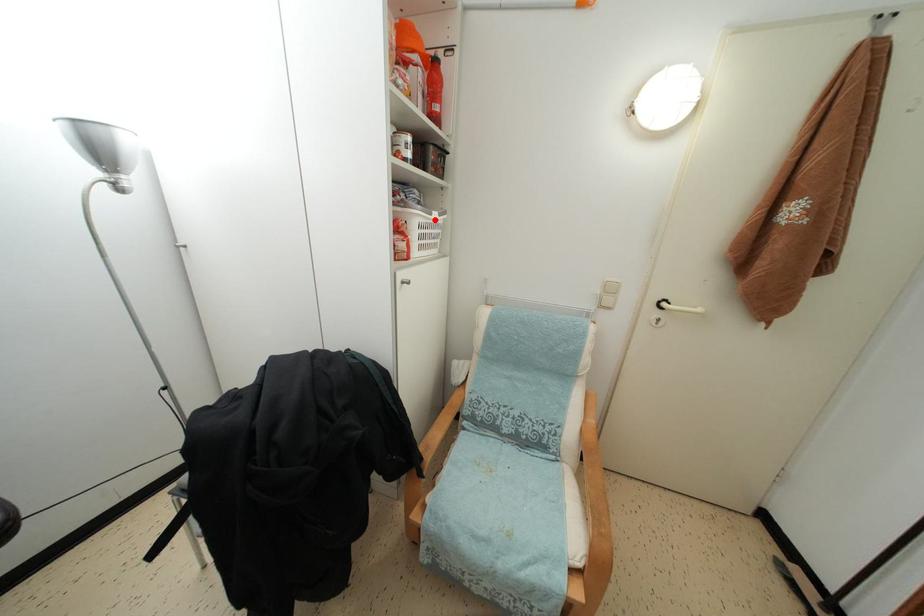
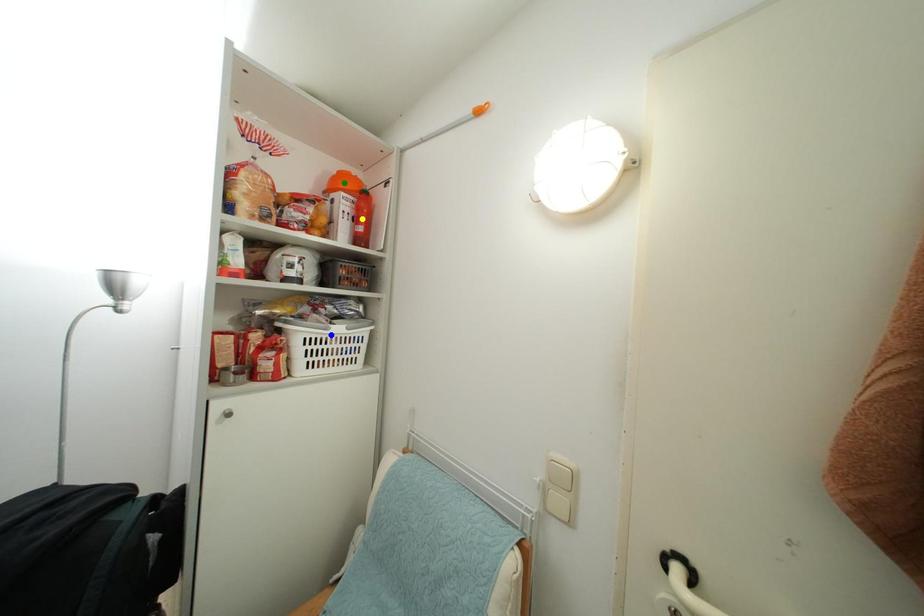
Question: I am providing you with two images of the same scene from different viewpoints. A red point is marked on the first image. You are given multiple points on the second image. Can you choose the point in image 2 that corresponds to the point in image 1?

Choices:
 (A) yellow point
 (B) blue point
 (C) green point

Answer: (B)